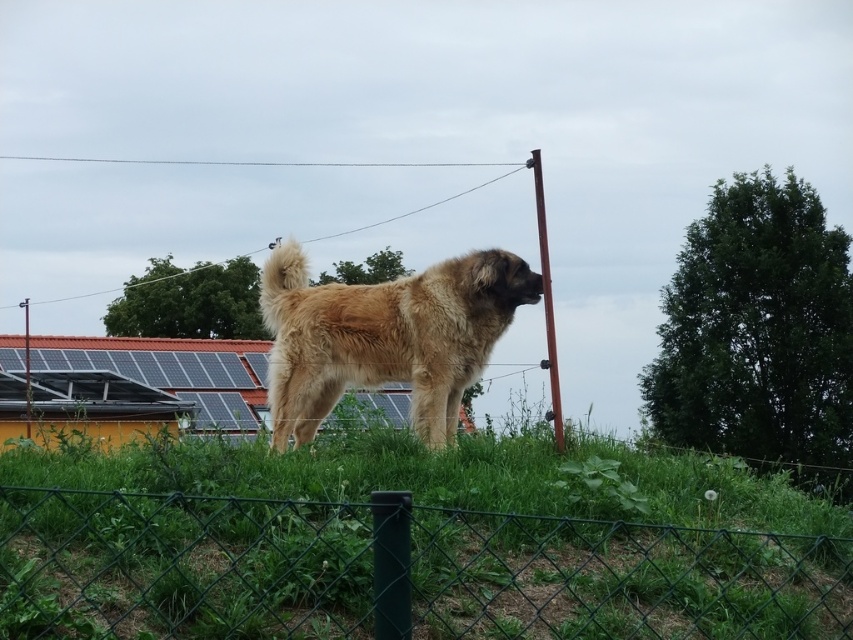
Question: Among these points, which one is nearest to the camera?

Choices:
 (A) pyautogui.click(x=131, y=557)
 (B) pyautogui.click(x=488, y=276)

Answer: (A)

Question: Which of the following is the closest to the observer?

Choices:
 (A) green wire mesh fence at lower center
 (B) fuzzy golden dog at center

Answer: (A)

Question: Can you confirm if green wire mesh fence at lower center is smaller than fuzzy golden dog at center?

Choices:
 (A) no
 (B) yes

Answer: (A)

Question: Is green wire mesh fence at lower center wider than fuzzy golden dog at center?

Choices:
 (A) no
 (B) yes

Answer: (B)

Question: Among these points, which one is farthest from the camera?

Choices:
 (A) (270, 380)
 (B) (366, 508)

Answer: (A)

Question: Is green wire mesh fence at lower center wider than fuzzy golden dog at center?

Choices:
 (A) yes
 (B) no

Answer: (A)